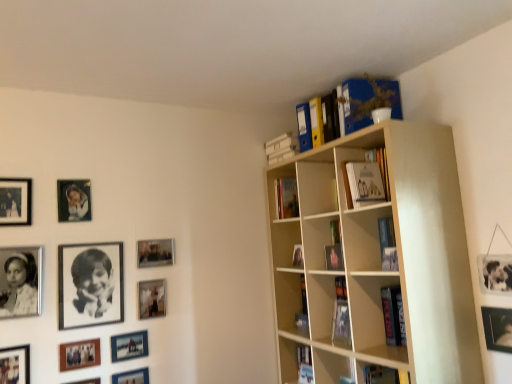
Question: Relative to black paper at upper left, which is counted as the 7th picture frame, starting from the left, is matte black photo frame at upper left, positioned as the 9th picture frame in right-to-left order, in front or behind?

Choices:
 (A) front
 (B) behind

Answer: (B)

Question: Is point (72, 210) closer or farther from the camera than point (87, 296)?

Choices:
 (A) closer
 (B) farther

Answer: (B)

Question: Which object is positioned closest to the matte silver picture frame at center-left, which ranks as the 3th picture frame in right-to-left order?

Choices:
 (A) matte black photo frame at upper left, positioned as the 9th picture frame in right-to-left order
 (B) blue cardboard file at upper right
 (C) beige wood bookcase at upper right
 (D) black matte photo frame at lower left, which is the 11th picture frame from right to left
 (E) matte black picture frame at center-left, the eleventh picture frame viewed from the left

Answer: (E)

Question: Estimate the real-world distances between objects in this image. Which object is closer to the metallic silver photo frame at lower left, marked as the fourth picture frame in a right-to-left arrangement?

Choices:
 (A) black matte photo frame at lower left, which is the 11th picture frame from right to left
 (B) matte black picture frame at lower left, which is the 7th picture frame in right-to-left order
 (C) black paper at upper left, the 6th picture frame from the right
 (D) matte black picture frame at center-left, the 2th picture frame viewed from the right
 (E) metallic silver photo frame at lower left, acting as the 8th picture frame starting from the left

Answer: (E)